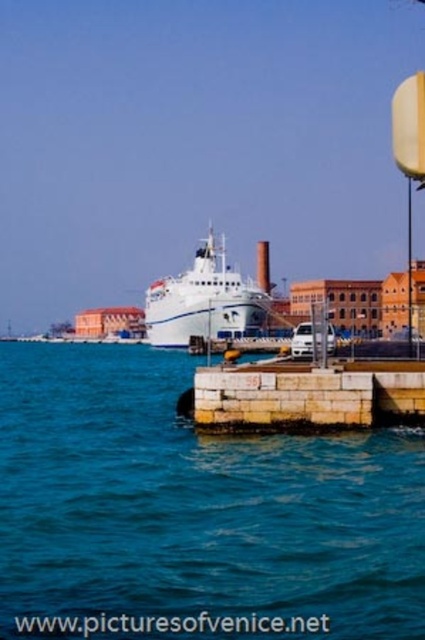
Question: Which point appears closest to the camera in this image?

Choices:
 (A) (323, 634)
 (B) (183, 324)

Answer: (A)

Question: Which of the following is the closest to the observer?

Choices:
 (A) white glossy cruise ship at center
 (B) blue water at center

Answer: (B)

Question: Observing the image, what is the correct spatial positioning of blue water at center in reference to white glossy cruise ship at center?

Choices:
 (A) right
 (B) left

Answer: (A)

Question: Is blue water at center wider than white glossy cruise ship at center?

Choices:
 (A) yes
 (B) no

Answer: (A)

Question: Is blue water at center wider than white glossy cruise ship at center?

Choices:
 (A) no
 (B) yes

Answer: (B)